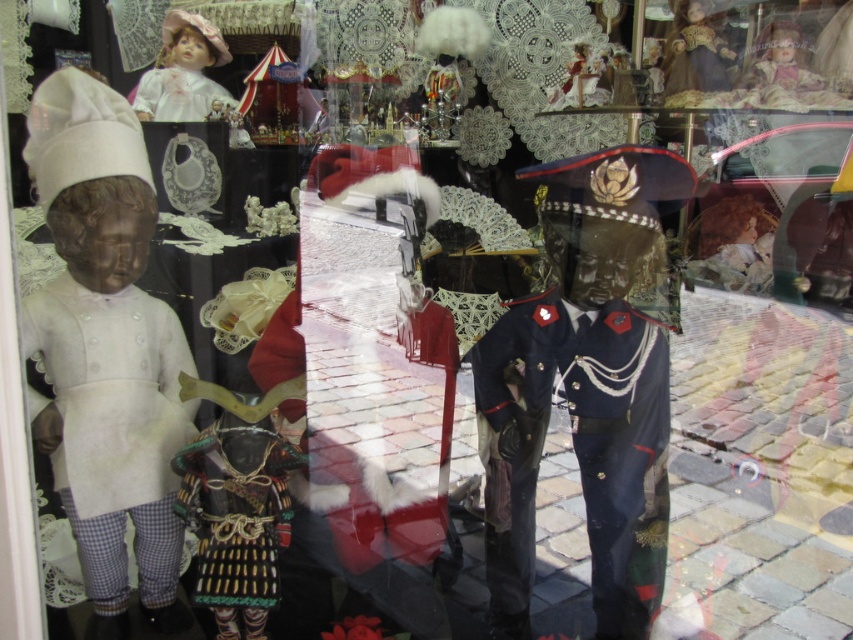
Question: Is navy blue fabric uniform at center in front of white lace dress at upper left?

Choices:
 (A) no
 (B) yes

Answer: (B)

Question: Is navy blue fabric uniform at center smaller than white matte fabric at left?

Choices:
 (A) no
 (B) yes

Answer: (A)

Question: Which object appears farthest from the camera in this image?

Choices:
 (A) white lace dress at upper left
 (B) white matte fabric at left

Answer: (A)

Question: Which of the following is the farthest from the observer?

Choices:
 (A) white matte fabric at left
 (B) porcelain doll at upper left

Answer: (B)

Question: Estimate the real-world distances between objects in this image. Which object is closer to the white lace dress at upper left?

Choices:
 (A) porcelain doll at upper left
 (B) navy blue fabric uniform at center

Answer: (A)

Question: Is navy blue fabric uniform at center wider than white lace dress at upper left?

Choices:
 (A) no
 (B) yes

Answer: (B)